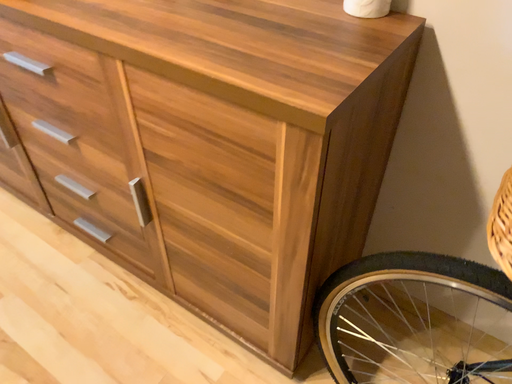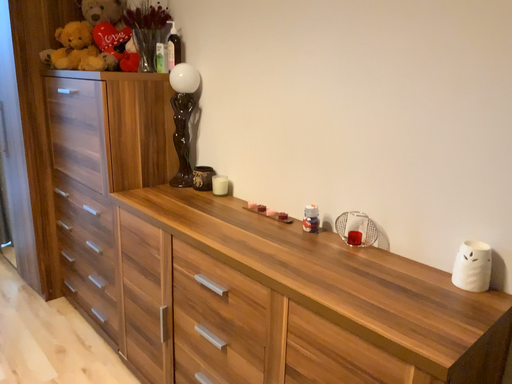
Question: How did the camera likely rotate when shooting the video?

Choices:
 (A) rotated left
 (B) rotated right

Answer: (A)